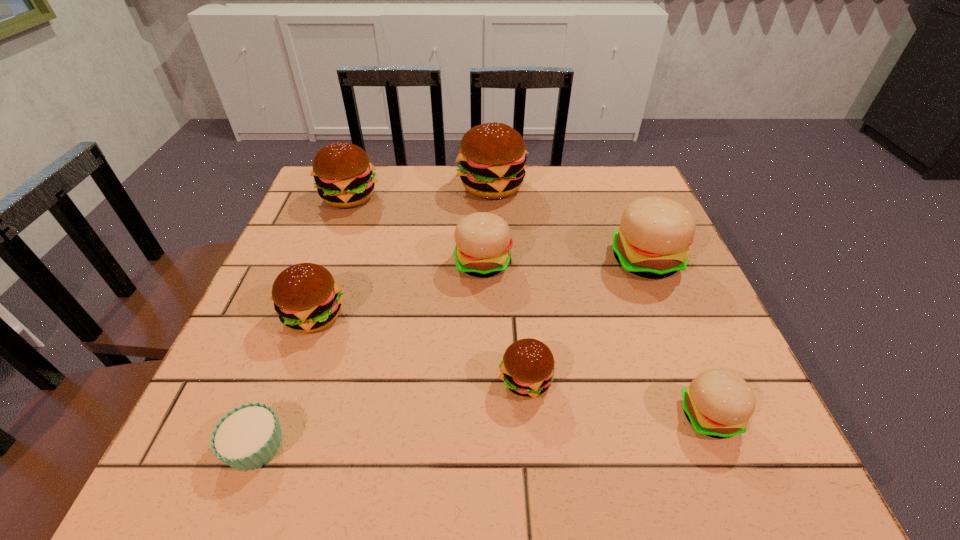
Locate an element on the screen. free space that satisfies the following two spatial constraints: 1. on the back side of the biggest brown hamburger; 2. on the left side of the cupcake is located at coordinates (353, 186).